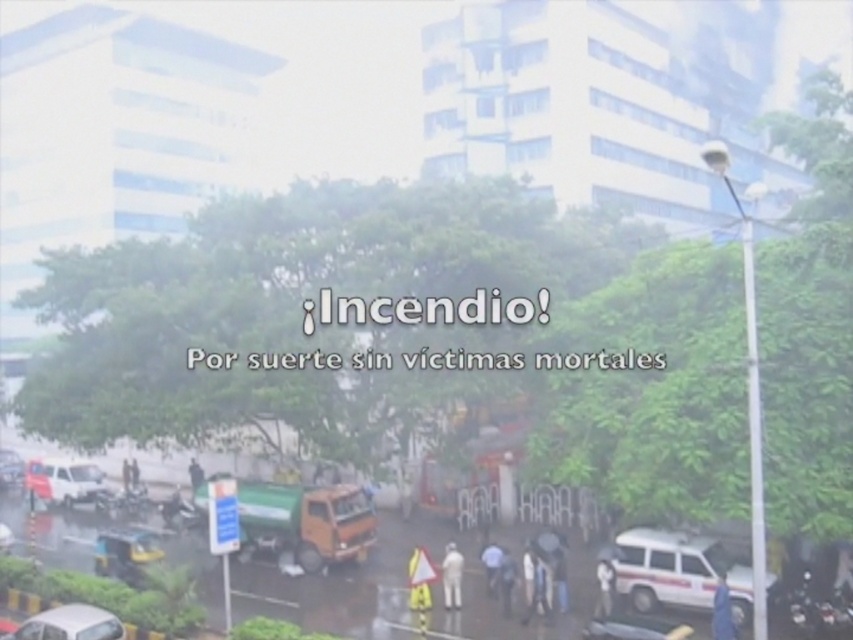
Identify the location of white matte ambulance at lower right. (677, 572).

The image size is (853, 640). What are the coordinates of `white matte ambulance at lower right` in the screenshot? It's located at (677, 572).

Locate an element on the screen. This screenshot has height=640, width=853. white matte ambulance at lower right is located at coordinates (677, 572).

Does white matte van at lower left have a lesser height compared to dark gray fabric at center?

Incorrect, white matte van at lower left's height does not fall short of dark gray fabric at center's.

Measure the distance between white matte van at lower left and dark gray fabric at center.

The distance of white matte van at lower left from dark gray fabric at center is 5.04 meters.

Who is more forward, (55, 486) or (202, 477)?

Point (202, 477)

Locate an element on the screen. white matte van at lower left is located at coordinates (62, 480).

Does metallic silver car at center come in front of metallic silver car at lower left?

Yes, metallic silver car at center is closer to the viewer.

Can you confirm if metallic silver car at center is taller than metallic silver car at lower left?

Yes, metallic silver car at center is taller than metallic silver car at lower left.

Is point (683, 636) positioned in front of point (16, 476)?

Yes.

The image size is (853, 640). What are the coordinates of `metallic silver car at center` in the screenshot? It's located at (635, 628).